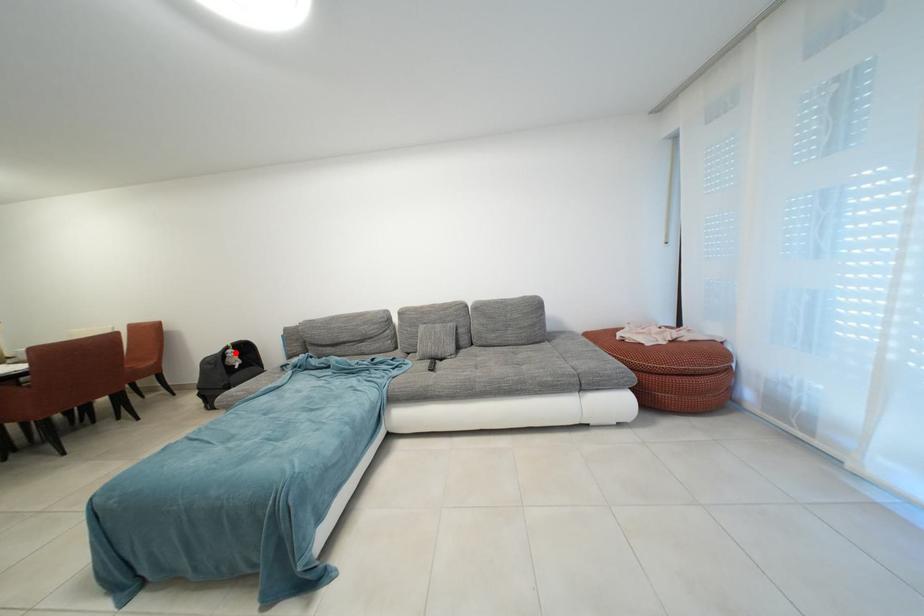
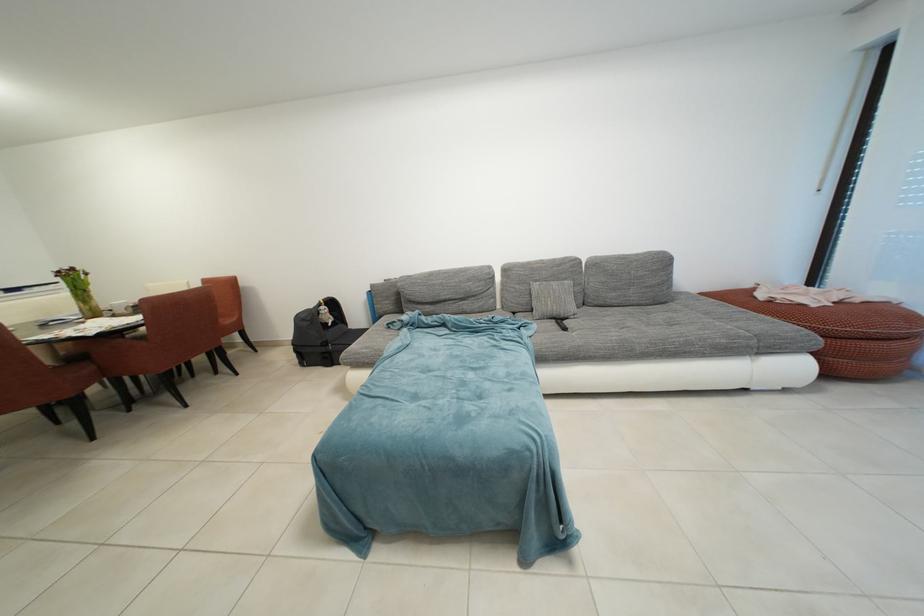
The point at the highlighted location is marked in the first image. Where is the corresponding point in the second image?

(329, 309)